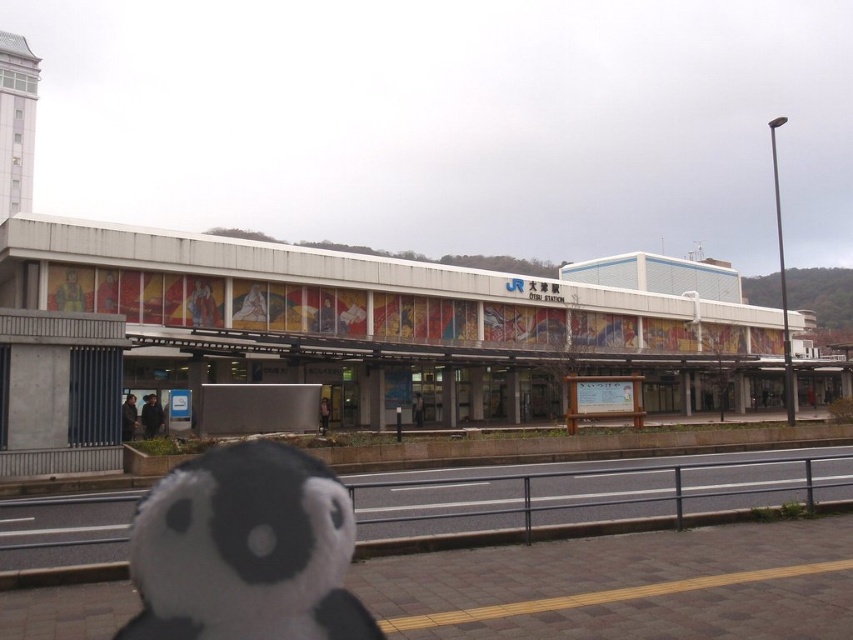
Question: Which of the following is the farthest from the observer?

Choices:
 (A) black rubber train track at lower left
 (B) white plush at lower left

Answer: (A)

Question: Is white plush at lower left bigger than black rubber train track at lower left?

Choices:
 (A) yes
 (B) no

Answer: (B)

Question: Among these objects, which one is nearest to the camera?

Choices:
 (A) white plush at lower left
 (B) black rubber train track at lower left

Answer: (A)

Question: Does white plush at lower left appear on the left side of black rubber train track at lower left?

Choices:
 (A) no
 (B) yes

Answer: (B)

Question: Is white plush at lower left below black rubber train track at lower left?

Choices:
 (A) yes
 (B) no

Answer: (B)